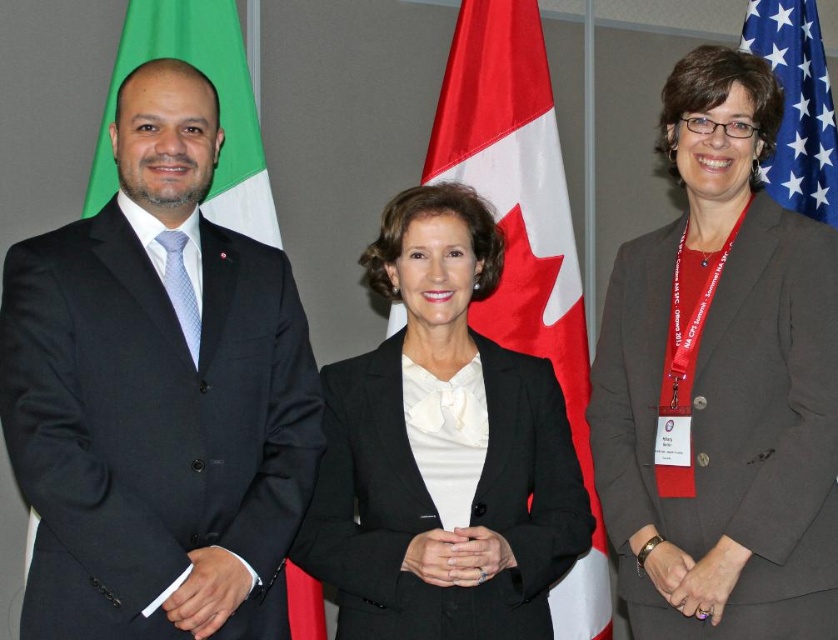
Is black suit at left closer to the viewer compared to red/white fabric flag at center?

Yes, black suit at left is closer to the viewer.

Does black suit at left have a lesser width compared to red/white fabric flag at center?

Indeed, black suit at left has a lesser width compared to red/white fabric flag at center.

Between point (202, 428) and point (577, 284), which one is positioned behind?

Positioned behind is point (577, 284).

Identify the location of black suit at left. Image resolution: width=838 pixels, height=640 pixels. (158, 394).

Is black suit at left further to camera compared to black matte suit at center?

That is False.

Between black suit at left and black matte suit at center, which one appears on the right side from the viewer's perspective?

From the viewer's perspective, black matte suit at center appears more on the right side.

Locate an element on the screen. black suit at left is located at coordinates (158, 394).

The height and width of the screenshot is (640, 838). What are the coordinates of `black suit at left` in the screenshot? It's located at (158, 394).

Which is more to the right, black matte suit at center or red/white fabric flag at center?

Positioned to the right is red/white fabric flag at center.

Can you confirm if black matte suit at center is positioned to the right of red/white fabric flag at center?

No, black matte suit at center is not to the right of red/white fabric flag at center.

Which is behind, point (440, 506) or point (547, 180)?

Positioned behind is point (547, 180).

Identify the location of black matte suit at center. Image resolution: width=838 pixels, height=640 pixels. (442, 451).